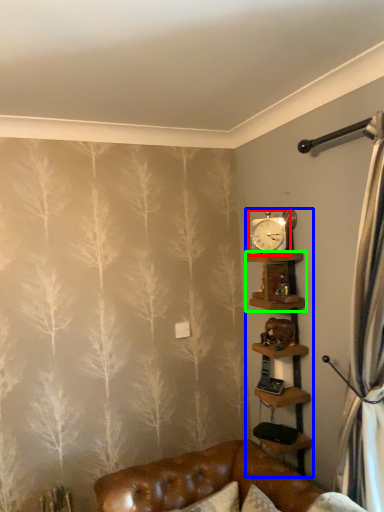
Question: Which object is the farthest from clock (highlighted by a red box)? Choose among these: shelf (highlighted by a blue box) or shelf (highlighted by a green box).

Choices:
 (A) shelf
 (B) shelf

Answer: (A)